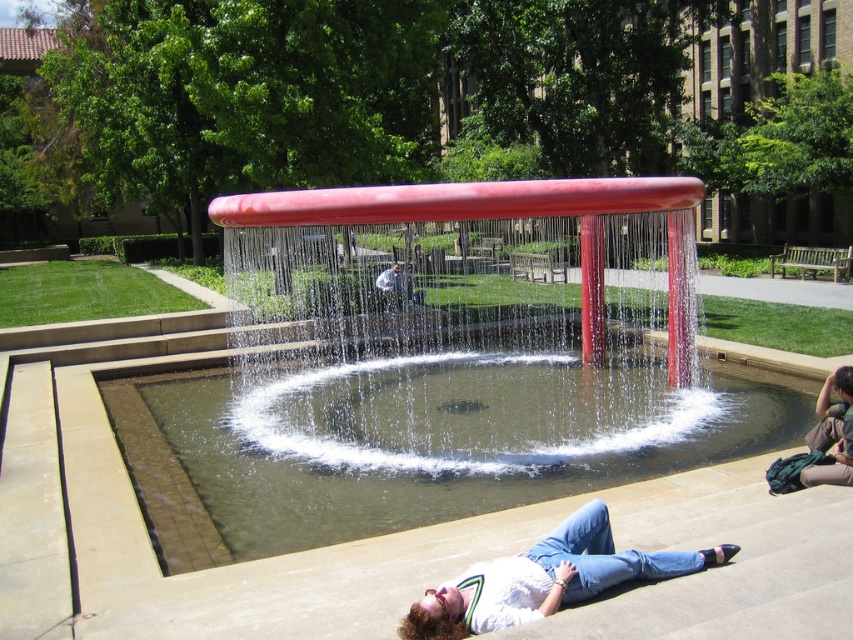
You are standing at the entrance of the fountain area and see the white matte shirt at lower center. If you want to approach the shirt, which direction should you move relative to the fountain?

Since the white matte shirt at lower center is located at point (544,579), you should move towards the lower center direction relative to the fountain to reach it.

You are standing at the point labeled point (543, 605) and want to walk to the point labeled point (834, 435). According to the scene description, will you have to walk towards the fountain or away from it?

Since point (543, 605) is in front of point (834, 435), you are already closer to the fountain than the destination point. Therefore, you will need to walk away from the fountain to reach point (834, 435).

You are a photographer trying to capture the person lying on the fountain steps. Based on the scene, where should you position your camera to ensure both the white matte shirt at lower center and the denim jeans at lower right are fully visible in the frame?

To ensure both the white matte shirt at lower center and the denim jeans at lower right are fully visible, position the camera at a low angle so that the white matte shirt at lower center is visible above the denim jeans at lower right, as the white matte shirt at lower center is positioned under the denim jeans at lower right.